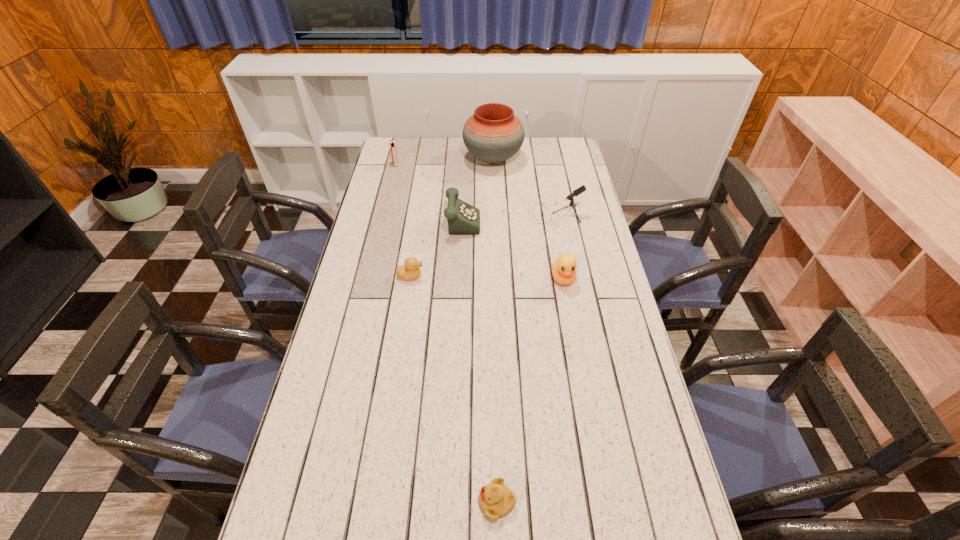
What are the coordinates of `vacant region located 0.280m on the stand of the microphone` in the screenshot? It's located at (457, 213).

This screenshot has height=540, width=960. Find the location of `free spot located 0.070m on the stand of the microphone`. free spot located 0.070m on the stand of the microphone is located at coordinates (511, 213).

At what (x,y) coordinates should I click in order to perform the action: click on vacant space located on the stand of the microphone. Please return your answer as a coordinate pair (x, y). Looking at the image, I should click on (508, 213).

Identify the location of vacant space located on the dial of the telephone. (547, 219).

Find the location of `free space located on the right of the leftmost object`. free space located on the right of the leftmost object is located at coordinates (457, 164).

The height and width of the screenshot is (540, 960). I want to click on free space located 0.200m on the face of the rightmost duckling, so click(574, 340).

Where is `free spot located 0.340m facing forward on the leftmost duckling`? The image size is (960, 540). free spot located 0.340m facing forward on the leftmost duckling is located at coordinates (524, 276).

This screenshot has width=960, height=540. I want to click on blank area located on the front-facing side of the second duckling from left to right, so click(x=315, y=501).

The height and width of the screenshot is (540, 960). I want to click on vacant space located 0.290m on the front-facing side of the second duckling from left to right, so click(350, 501).

Where is `vacant position located on the front-facing side of the second duckling from left to right`? This screenshot has height=540, width=960. vacant position located on the front-facing side of the second duckling from left to right is located at coordinates (377, 501).